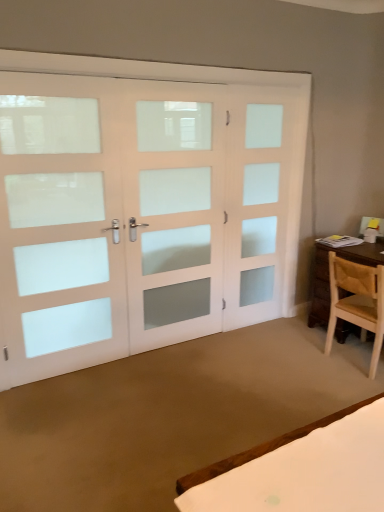
Question: In the image, is white frosted glass door at center, which ranks as the 2th screen door in right-to-left order, positioned in front of or behind white frosted glass door at right, which appears as the 3th screen door when viewed from the left?

Choices:
 (A) front
 (B) behind

Answer: (A)

Question: Considering the positions of white frosted glass door at center, which ranks as the 2th screen door in right-to-left order, and white frosted glass door at right, placed as the first screen door when sorted from right to left, in the image, is white frosted glass door at center, which ranks as the 2th screen door in right-to-left order, wider or thinner than white frosted glass door at right, placed as the first screen door when sorted from right to left,?

Choices:
 (A) thin
 (B) wide

Answer: (B)

Question: Which object is positioned farthest from the white frosted glass door at left, the first screen door from the left?

Choices:
 (A) light brown wooden chair at right
 (B) white frosted glass door at right, placed as the first screen door when sorted from right to left
 (C) white frosted glass door at center, which ranks as the 2th screen door in right-to-left order

Answer: (A)

Question: Which object is the farthest from the white frosted glass door at right, placed as the first screen door when sorted from right to left?

Choices:
 (A) light brown wooden chair at right
 (B) white frosted glass door at center, placed as the second screen door when sorted from left to right
 (C) white frosted glass door at left, positioned as the third screen door in right-to-left order

Answer: (C)